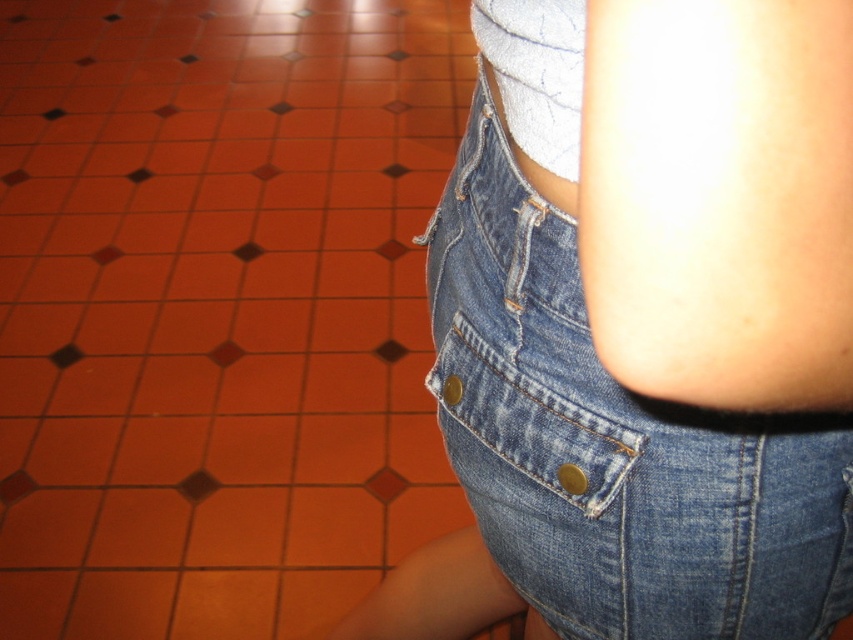
Which is below, denim shorts at center or denim pocket at lower right?

denim pocket at lower right

Where is `denim shorts at center`? The image size is (853, 640). denim shorts at center is located at coordinates (614, 444).

Does orange tile at center appear over denim shorts at center?

Yes, orange tile at center is above denim shorts at center.

Who is more distant from viewer, (357, 493) or (503, 506)?

The point (357, 493) is behind.

Image resolution: width=853 pixels, height=640 pixels. Find the location of `orange tile at center`. orange tile at center is located at coordinates (218, 308).

Is orange tile at center positioned in front of denim pocket at lower right?

No, orange tile at center is behind denim pocket at lower right.

Which is more to the right, orange tile at center or denim pocket at lower right?

From the viewer's perspective, denim pocket at lower right appears more on the right side.

Describe the element at coordinates (218, 308) in the screenshot. This screenshot has width=853, height=640. I see `orange tile at center` at that location.

You are a GUI agent. You are given a task and a screenshot of the screen. Output one action in this format:
    pyautogui.click(x=<x>, y=<y>)
    Task: Click on the orange tile at center
    The height and width of the screenshot is (640, 853).
    Given the screenshot: What is the action you would take?
    pyautogui.click(x=218, y=308)